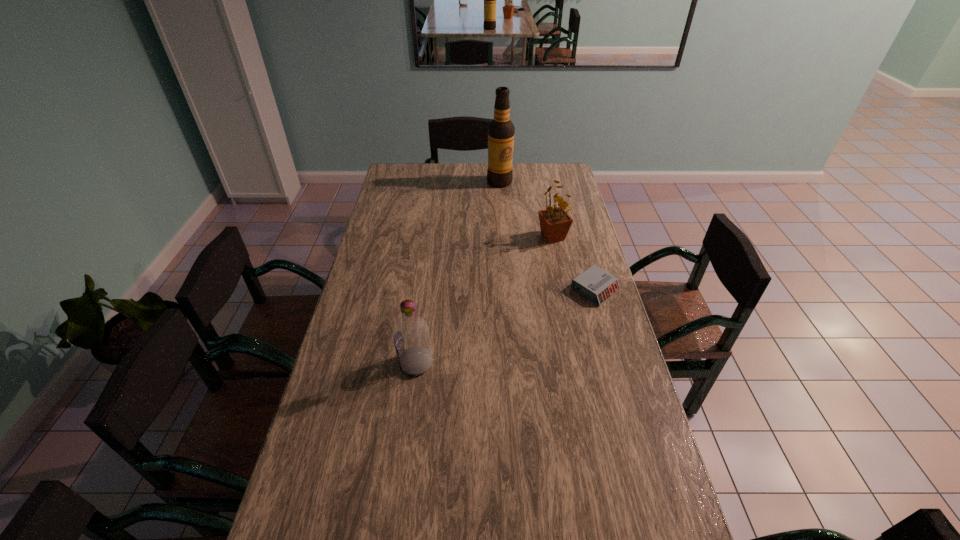
Where is `free spot located on the label of the alcohol`? Image resolution: width=960 pixels, height=540 pixels. free spot located on the label of the alcohol is located at coordinates (502, 197).

Find the location of `free location located 0.270m on the label of the alcohol`. free location located 0.270m on the label of the alcohol is located at coordinates pos(507,221).

Where is `vacant space located at the front of the second farthest object with flowers visible`? The width and height of the screenshot is (960, 540). vacant space located at the front of the second farthest object with flowers visible is located at coordinates (531, 274).

Find the location of a particular element. This screenshot has height=540, width=960. vacant region located 0.320m at the front of the second farthest object with flowers visible is located at coordinates (517, 297).

The image size is (960, 540). Find the location of `vacant point located 0.190m at the front of the second farthest object with flowers visible`. vacant point located 0.190m at the front of the second farthest object with flowers visible is located at coordinates (531, 274).

This screenshot has height=540, width=960. Identify the location of object that is at the far edge. (501, 130).

I want to click on alarm clock present at the right edge, so click(595, 284).

You are a GUI agent. You are given a task and a screenshot of the screen. Output one action in this format:
    pyautogui.click(x=<x>, y=<y>)
    Task: Click on the sunflower present at the right edge
    The width and height of the screenshot is (960, 540).
    Given the screenshot: What is the action you would take?
    pyautogui.click(x=555, y=222)

Identify the location of free space at the far edge. This screenshot has height=540, width=960. (531, 167).

At what (x,y) coordinates should I click in order to perform the action: click on vacant region at the left edge of the desktop. Please return your answer as a coordinate pair (x, y). Looking at the image, I should click on (383, 297).